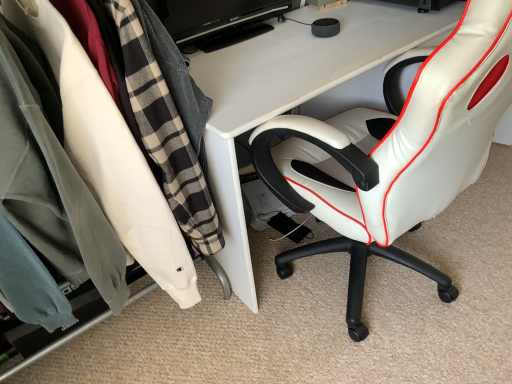
I want to click on matte white clothing rack at left, so click(x=109, y=156).

Measure the distance between white leather chair at right and camera.

26.26 inches.

Image resolution: width=512 pixels, height=384 pixels. In order to click on black glossy monitor at upper center in this screenshot , I will do `click(213, 16)`.

Looking at this image, looking at the image, does white leather chair at right seem bigger or smaller compared to matte white clothing rack at left?

Clearly, white leather chair at right is larger in size than matte white clothing rack at left.

Find the location of `closet above the white leather chair at right (from a real-world perspective)`. closet above the white leather chair at right (from a real-world perspective) is located at coordinates (109, 156).

Is point (367, 146) more distant than point (85, 174)?

Yes, it is behind point (85, 174).

Is white leather chair at right positioned far away from matte white clothing rack at left?

No.

From the picture: Is white leather chair at right turned away from black glossy monitor at upper center?

No, white leather chair at right is not facing away from black glossy monitor at upper center.

Between point (439, 70) and point (200, 28), which one is positioned behind?

The point (200, 28) is farther.

Is white leather chair at right further to camera compared to black glossy monitor at upper center?

That is False.

From the image's perspective, between white leather chair at right and black glossy monitor at upper center, who is located below?

white leather chair at right is shown below in the image.

Which object is wider, matte white clothing rack at left or white leather chair at right?

Wider between the two is white leather chair at right.

Does matte white clothing rack at left turn towards white leather chair at right?

No, matte white clothing rack at left does not turn towards white leather chair at right.

Considering the sizes of objects matte white clothing rack at left and white leather chair at right in the image provided, who is smaller, matte white clothing rack at left or white leather chair at right?

Smaller between the two is matte white clothing rack at left.

From the image's perspective, which one is positioned higher, matte white clothing rack at left or white leather chair at right?

white leather chair at right.

Who is smaller, matte white clothing rack at left or black glossy monitor at upper center?

black glossy monitor at upper center is smaller.

Considering the relative sizes of matte white clothing rack at left and black glossy monitor at upper center in the image provided, is matte white clothing rack at left taller than black glossy monitor at upper center?

Correct, matte white clothing rack at left is much taller as black glossy monitor at upper center.

In the scene shown: Considering the relative sizes of matte white clothing rack at left and black glossy monitor at upper center in the image provided, is matte white clothing rack at left thinner than black glossy monitor at upper center?

No, matte white clothing rack at left is not thinner than black glossy monitor at upper center.

Is matte white clothing rack at left oriented towards black glossy monitor at upper center?

No, matte white clothing rack at left is not oriented towards black glossy monitor at upper center.

Does black glossy monitor at upper center lie in front of matte white clothing rack at left?

No, it is behind matte white clothing rack at left.

The width and height of the screenshot is (512, 384). What are the coordinates of `computer monitor above the matte white clothing rack at left (from the image's perspective)` in the screenshot? It's located at (213, 16).

Does black glossy monitor at upper center have a lesser width compared to matte white clothing rack at left?

Yes, black glossy monitor at upper center is thinner than matte white clothing rack at left.

Is black glossy monitor at upper center in front of white leather chair at right?

No, the depth of black glossy monitor at upper center is greater than that of white leather chair at right.

Is black glossy monitor at upper center facing away from white leather chair at right?

No, black glossy monitor at upper center is not facing the opposite direction of white leather chair at right.

Is black glossy monitor at upper center inside or outside of white leather chair at right?

black glossy monitor at upper center exists outside the volume of white leather chair at right.

Find the location of a particular element. chair below the matte white clothing rack at left (from a real-world perspective) is located at coordinates (395, 154).

I want to click on chair in front of the black glossy monitor at upper center, so click(x=395, y=154).

Looking at the image, which one is located further to white leather chair at right, black glossy monitor at upper center or matte white clothing rack at left?

Based on the image, black glossy monitor at upper center appears to be further to white leather chair at right.

Which object lies further to the anchor point black glossy monitor at upper center, white leather chair at right or matte white clothing rack at left?

Based on the image, white leather chair at right appears to be further to black glossy monitor at upper center.

Which object lies nearer to the anchor point black glossy monitor at upper center, matte white clothing rack at left or white leather chair at right?

matte white clothing rack at left.

Based on their spatial positions, is matte white clothing rack at left or black glossy monitor at upper center further from white leather chair at right?

black glossy monitor at upper center lies further to white leather chair at right than the other object.

Which object lies nearer to the anchor point matte white clothing rack at left, white leather chair at right or black glossy monitor at upper center?

white leather chair at right lies closer to matte white clothing rack at left than the other object.

When comparing their distances from matte white clothing rack at left, does black glossy monitor at upper center or white leather chair at right seem closer?

white leather chair at right.

Identify the location of computer monitor between matte white clothing rack at left and white leather chair at right in the horizontal direction. The width and height of the screenshot is (512, 384). (213, 16).